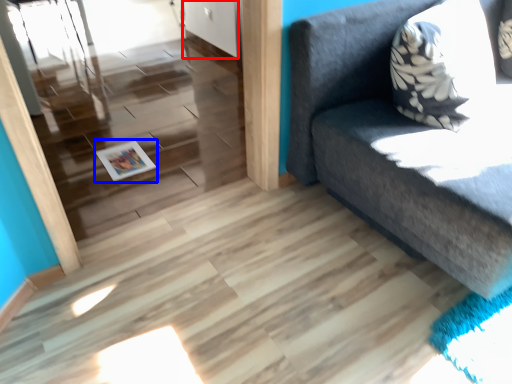
Question: Which of the following is the closest to the observer, door (highlighted by a red box) or magazine (highlighted by a blue box)?

Choices:
 (A) door
 (B) magazine

Answer: (B)